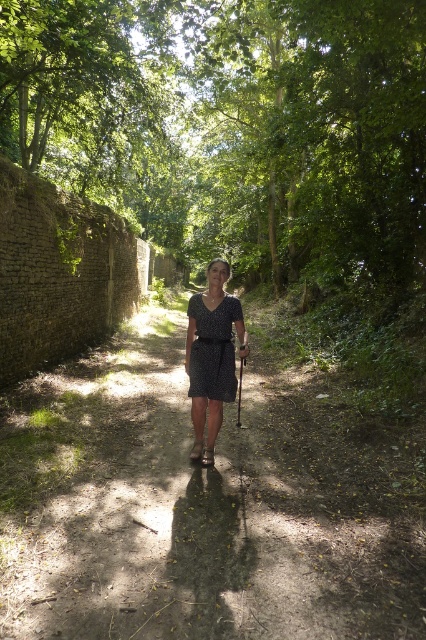
Question: Based on their relative distances, which object is nearer to the green leafy tree at center?

Choices:
 (A) dark dotted dress at center
 (B) dirt path at center
 (C) black dotted dress at center

Answer: (B)

Question: Estimate the real-world distances between objects in this image. Which object is farther from the green leafy tree at center?

Choices:
 (A) black dotted dress at center
 (B) dark dotted dress at center

Answer: (A)

Question: Does dirt path at center appear on the right side of black dotted dress at center?

Choices:
 (A) yes
 (B) no

Answer: (B)

Question: Which of the following is the closest to the observer?

Choices:
 (A) (227, 333)
 (B) (92, 120)

Answer: (A)

Question: Is dark dotted dress at center above black dotted dress at center?

Choices:
 (A) no
 (B) yes

Answer: (A)

Question: Can you confirm if dirt path at center is positioned above green leafy tree at center?

Choices:
 (A) yes
 (B) no

Answer: (B)